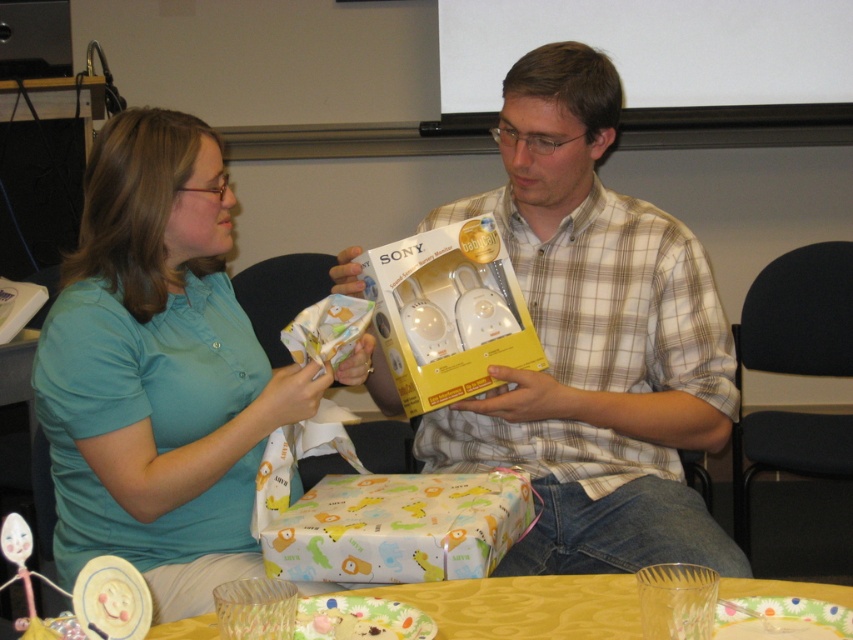
Question: Does plaid shirt at center appear over yellow fabric table at lower center?

Choices:
 (A) no
 (B) yes

Answer: (B)

Question: Which object is positioned closest to the teal fabric shirt at center?

Choices:
 (A) plaid shirt at center
 (B) printed paper gift at center
 (C) yellow fabric table at lower center

Answer: (B)

Question: Among these points, which one is farthest from the camera?

Choices:
 (A) tap(212, 141)
 (B) tap(161, 625)
 (C) tap(560, 88)

Answer: (C)

Question: Does plaid shirt at center lie behind printed paper gift at center?

Choices:
 (A) no
 (B) yes

Answer: (B)

Question: Which point appears closest to the camera in this image?

Choices:
 (A) (830, 586)
 (B) (163, 484)

Answer: (A)

Question: Does plaid shirt at center have a smaller size compared to printed paper gift at center?

Choices:
 (A) no
 (B) yes

Answer: (A)